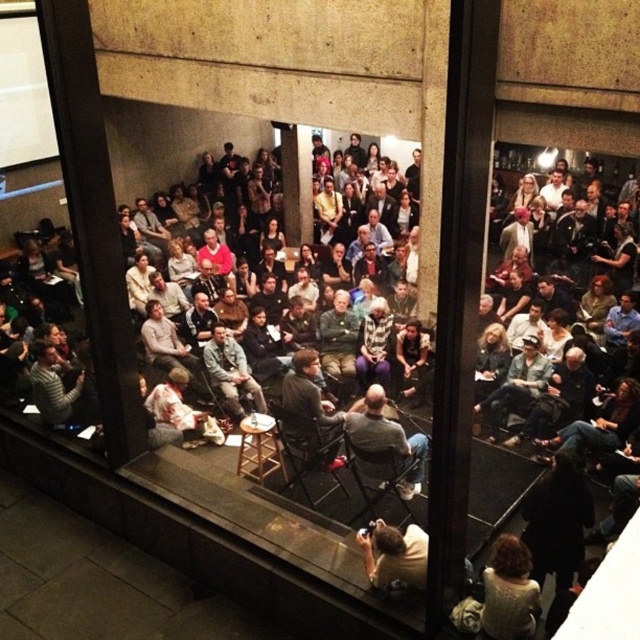
Question: Does white knit sweater at lower right appear on the left side of striped sweater at center?

Choices:
 (A) no
 (B) yes

Answer: (A)

Question: Is camouflage jacket at center smaller than yellow shirt at center?

Choices:
 (A) yes
 (B) no

Answer: (B)

Question: Among these points, which one is farthest from the camera?

Choices:
 (A) (323, 241)
 (B) (236, 412)
 (C) (67, 392)

Answer: (A)

Question: Which point is farther to the camera?

Choices:
 (A) (81, 380)
 (B) (218, 376)
 (C) (509, 536)

Answer: (B)

Question: Which of these objects is positioned farthest from the striped sweater at center?

Choices:
 (A) yellow shirt at center
 (B) white knit sweater at lower right

Answer: (A)

Question: From the image, what is the correct spatial relationship of camouflage jacket at center in relation to yellow shirt at center?

Choices:
 (A) below
 (B) above

Answer: (A)